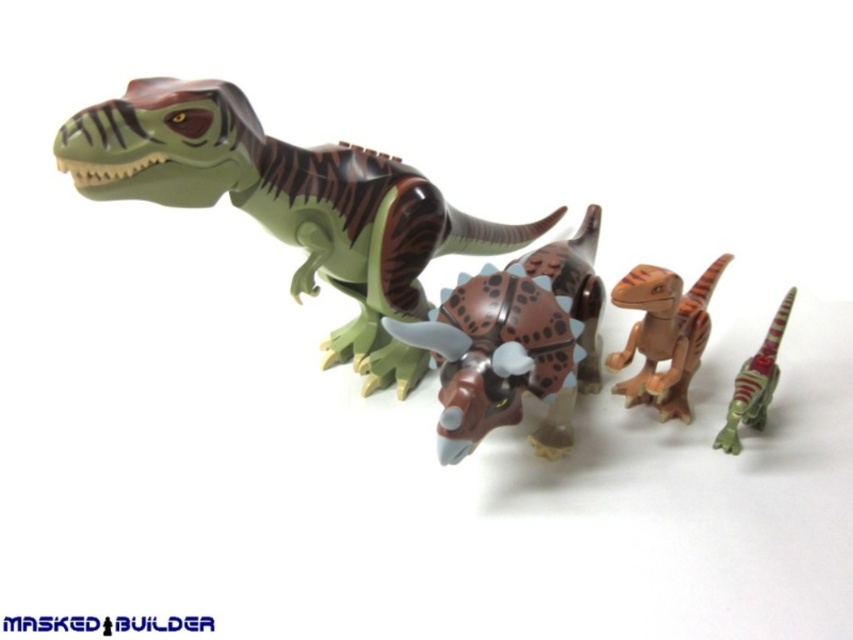
You are a photographer trying to capture a detailed shot of the two points in the image. Which point, point (671,291) or point (590,246), will appear larger in your photo?

Point (671,291) is closer to the viewer than point (590,246), so it will appear larger in the photo.

Looking at the LEGO dinosaurs arranged on the plain white background, which one is taller between the brown matte triceratops at center and the shiny green plastic dinosaur at lower right?

The brown matte triceratops at center is taller than the shiny green plastic dinosaur at lower right.